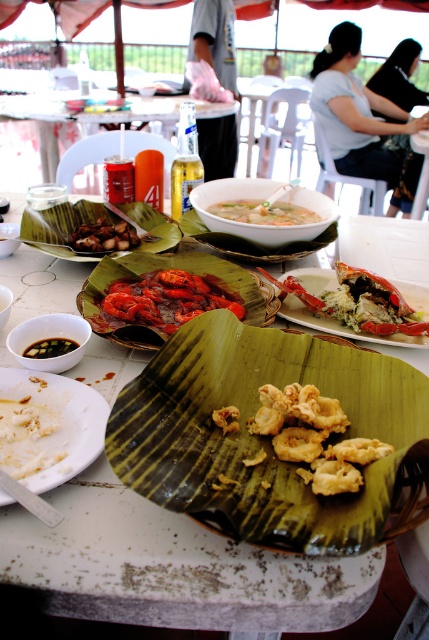
Question: Which is nearer to the white matte plate at lower left?

Choices:
 (A) golden crispy squid at center
 (B) white ceramic bowl at center

Answer: (A)

Question: Considering the relative positions of white matte plate at lower left and matte black bowl at center in the image provided, where is white matte plate at lower left located with respect to matte black bowl at center?

Choices:
 (A) above
 (B) below

Answer: (B)

Question: Which object appears closest to the camera in this image?

Choices:
 (A) black glossy sauce at center
 (B) brown matte fried food at center
 (C) matte black bowl at center

Answer: (A)

Question: Can you confirm if white creamy food at lower left is thinner than shiny red lobster at center?

Choices:
 (A) no
 (B) yes

Answer: (B)

Question: Can you confirm if white creamy food at lower left is positioned to the left of matte black bowl at center?

Choices:
 (A) no
 (B) yes

Answer: (A)

Question: Which point is closer to the camera?

Choices:
 (A) (172, 113)
 (B) (244, 237)
 (C) (271, 435)

Answer: (C)